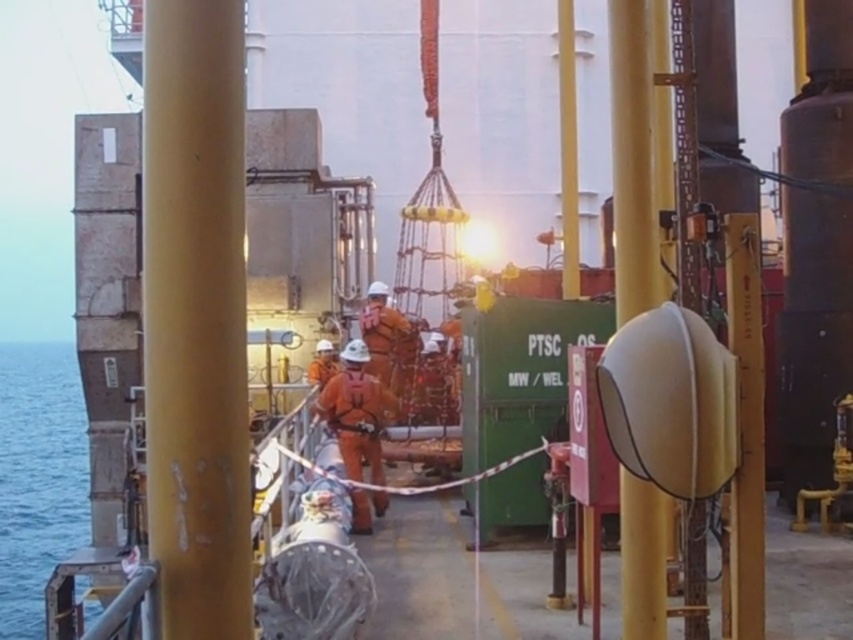
You are an inspector on the oil rig and need to ensure safety protocols are followed. From your current position, you see the orange fabric safety suit at center and the blue water at left. Which object is closer to you, and why?

The orange fabric safety suit at center is closer to you because it is positioned in front of the blue water at left, indicating it is nearer in the visual plane.

You are a worker on the offshore platform and need to secure a safety harness to the nearest pole. You are currently standing at point 0.5, 0.23. Is the smooth yellow pole at center within reach?

The smooth yellow pole at center is located at point (195, 316), which is very close to your current position at (195, 320). Therefore, you can easily reach the smooth yellow pole at center to secure your safety harness.